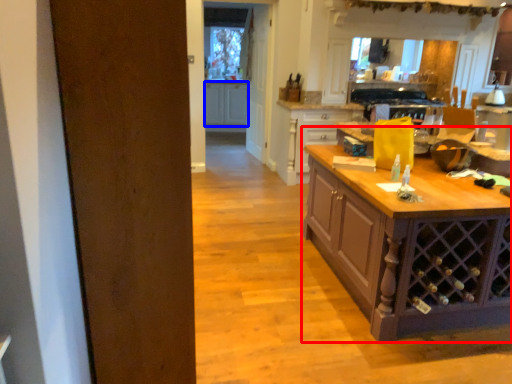
Question: Which object is closer to the camera taking this photo, table (highlighted by a red box) or cabinetry (highlighted by a blue box)?

Choices:
 (A) table
 (B) cabinetry

Answer: (A)